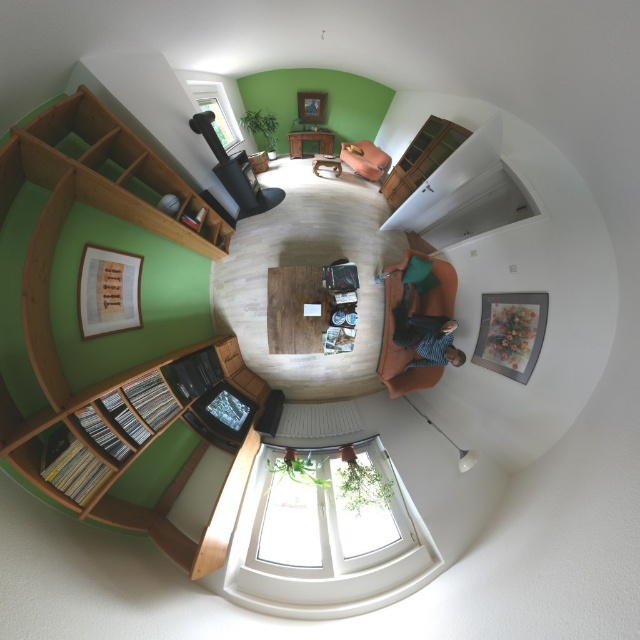
Who is positioned more to the left, white glass window at lower center or suede orange couch at center?

white glass window at lower center

Measure the distance between white glass window at lower center and camera.

white glass window at lower center and camera are 1.93 meters apart.

Where is `white glass window at lower center`? The image size is (640, 640). white glass window at lower center is located at coordinates (324, 545).

Between point (0, 445) and point (330, 577), which one is positioned in front?

Point (0, 445) is more forward.

Looking at this image, can you confirm if wooden bookcase at lower left is thinner than white glass window at lower center?

Yes, wooden bookcase at lower left is thinner than white glass window at lower center.

Image resolution: width=640 pixels, height=640 pixels. Find the location of `wooden bookcase at lower left`. wooden bookcase at lower left is located at coordinates (128, 426).

I want to click on wooden bookcase at lower left, so click(x=128, y=426).

Which is in front, point (438, 125) or point (401, 276)?

Point (401, 276)

Does wooden bookshelf at upper right have a larger size compared to green fabric couch at center?

Yes, wooden bookshelf at upper right is bigger than green fabric couch at center.

Where is `wooden bookshelf at upper right`? Image resolution: width=640 pixels, height=640 pixels. wooden bookshelf at upper right is located at coordinates [420, 157].

What are the coordinates of `wooden bookshelf at upper right` in the screenshot? It's located at (420, 157).